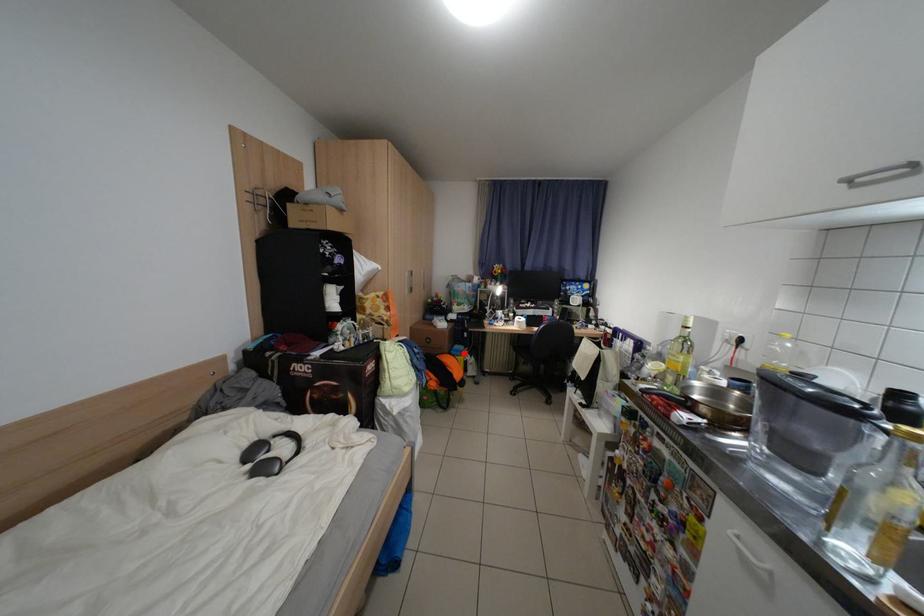
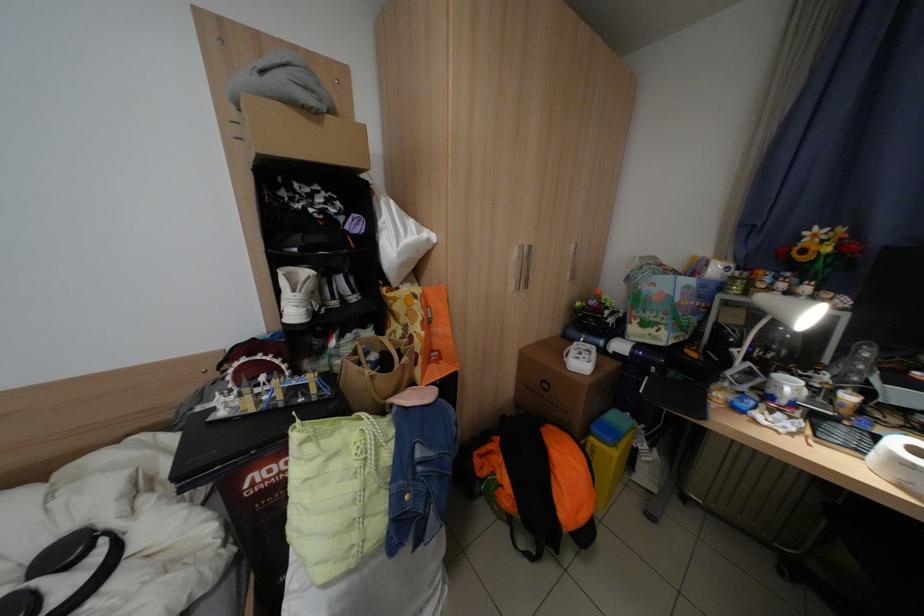
Locate, in the second image, the point that corresponds to the highlighted location in the first image.

(604, 430)